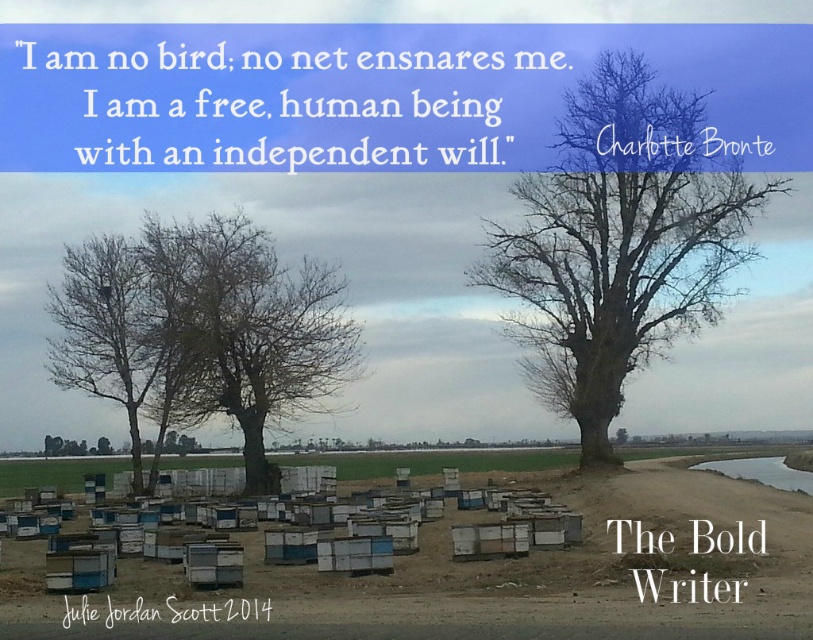
You are an apiarist inspecting the apiary. You notice two trees in the image. Which tree is positioned higher up in the image, the bare bark tree at right or the bare wood tree at center?

The bare bark tree at right is located above the bare wood tree at center, so it is positioned higher up in the image.

You are standing at the center of the image and want to walk to the nearest beehive. Which direction should you head relative to the bare bark tree at right?

The bare bark tree at right is located at point (620, 241). Since the beehives are in the foreground and the tree is at the right, you should head towards the left or center area away from the tree to reach the nearest beehive.

You are a bird seeking shelter. You see the bare bark tree at right and the bare wood tree at center. Which tree is taller and would provide a higher vantage point?

The bare bark tree at right is taller than the bare wood tree at center, so it would provide a higher vantage point.